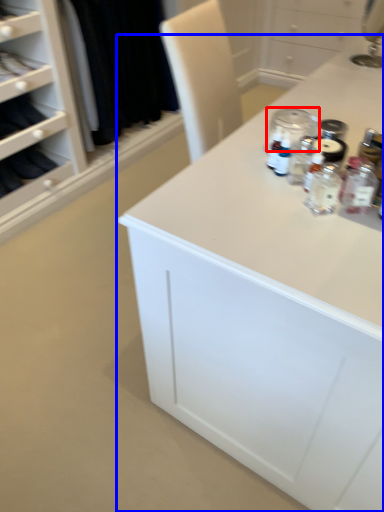
Question: Which of the following is the closest to the observer, glass jar (highlighted by a red box) or countertop (highlighted by a blue box)?

Choices:
 (A) glass jar
 (B) countertop

Answer: (B)